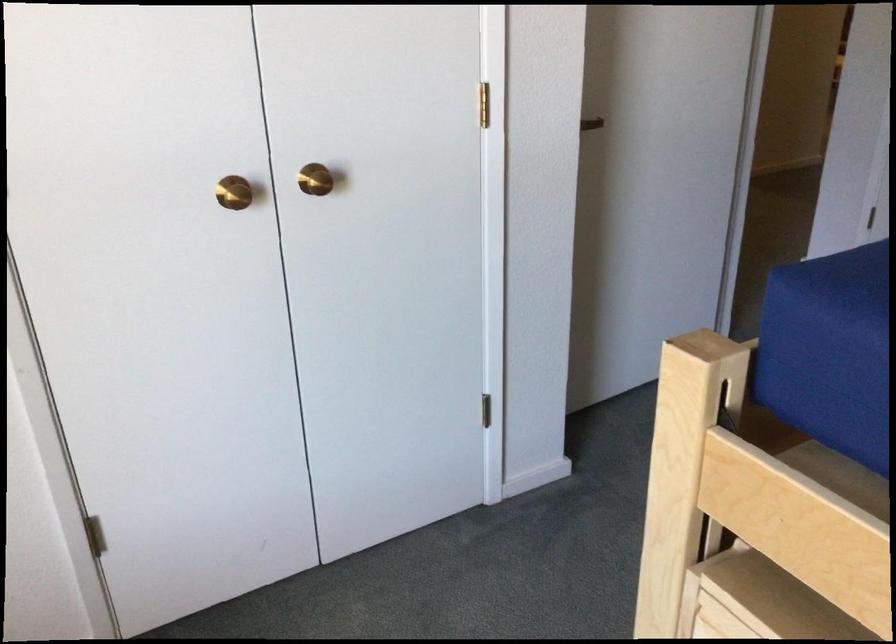
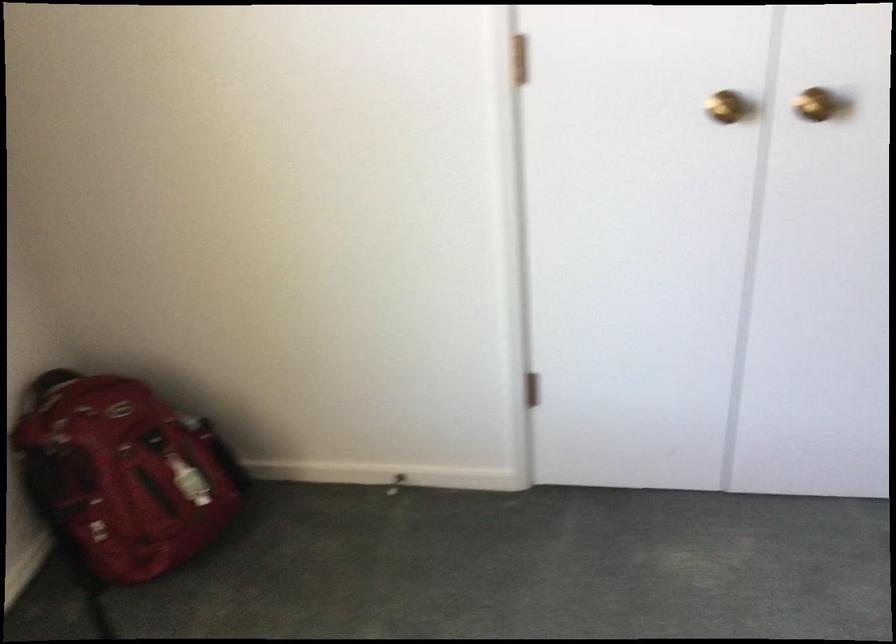
Find the pixel in the second image that matches (x=236, y=198) in the first image.

(725, 106)